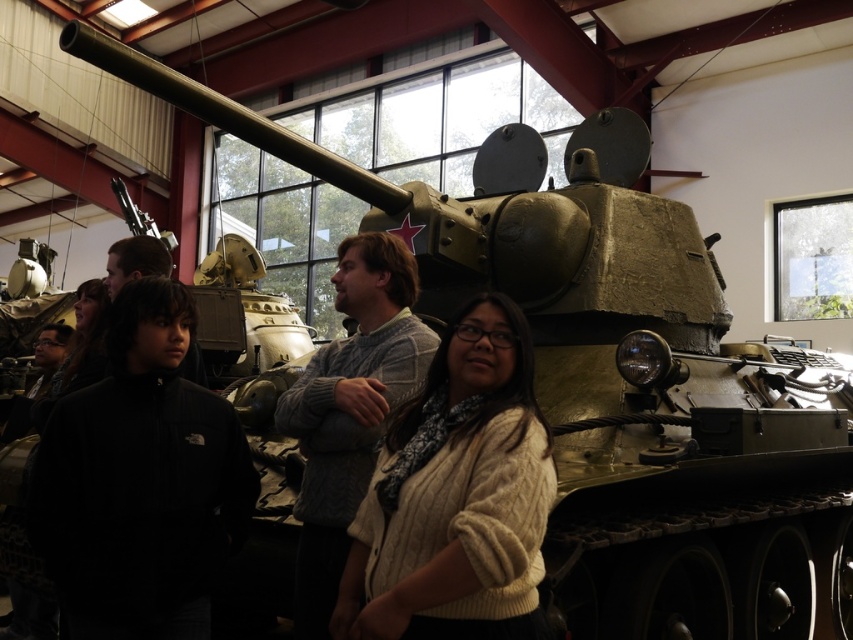
Between knitted sweater at center and dark brown sweater at left, which one appears on the right side from the viewer's perspective?

knitted sweater at center is more to the right.

Does point (379, 349) come behind point (109, 256)?

No, (379, 349) is closer to viewer.

Which is behind, point (317, 385) or point (161, 253)?

Point (161, 253)

Find the location of a particular element. knitted sweater at center is located at coordinates (350, 410).

Is white knit sweater at center shorter than knitted sweater at center?

Indeed, white knit sweater at center has a lesser height compared to knitted sweater at center.

Can you confirm if white knit sweater at center is taller than knitted sweater at center?

No, white knit sweater at center is not taller than knitted sweater at center.

Locate an element on the screen. The height and width of the screenshot is (640, 853). white knit sweater at center is located at coordinates (456, 497).

Identify the location of white knit sweater at center. The image size is (853, 640). (456, 497).

Does dark gray sweater at center appear on the left side of white knit sweater at center?

Correct, you'll find dark gray sweater at center to the left of white knit sweater at center.

Between point (73, 598) and point (515, 314), which one is positioned in front?

Point (515, 314) is more forward.

This screenshot has height=640, width=853. What are the coordinates of `dark gray sweater at center` in the screenshot? It's located at (140, 481).